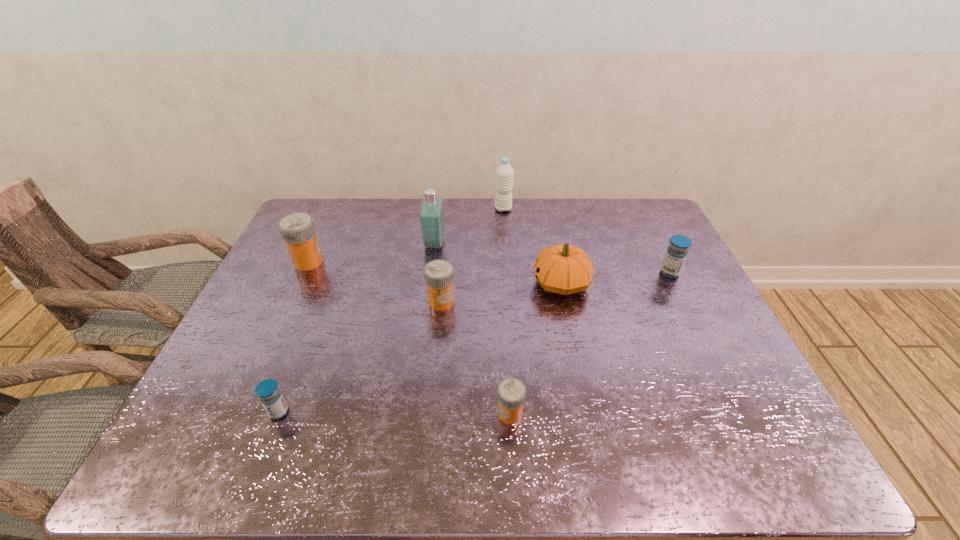
Locate an element on the screen. The width and height of the screenshot is (960, 540). vacant space located on the side of the second object from right to left with the carved face is located at coordinates (443, 283).

I want to click on free space located 0.330m on the front of the rightmost object, so click(718, 370).

Where is `blank space located on the label side of the third nearest medicine`? The width and height of the screenshot is (960, 540). blank space located on the label side of the third nearest medicine is located at coordinates (434, 381).

The image size is (960, 540). I want to click on free region located on the left of the second medicine from left to right, so click(201, 412).

Locate an element on the screen. vacant space situated on the label side of the nearest orange medicine is located at coordinates (424, 414).

You are a GUI agent. You are given a task and a screenshot of the screen. Output one action in this format:
    pyautogui.click(x=<x>, y=<y>)
    Task: Click on the vacant region located on the label side of the nearest orange medicine
    The height and width of the screenshot is (540, 960).
    Given the screenshot: What is the action you would take?
    pyautogui.click(x=416, y=414)

Where is `vacant space located 0.150m on the label side of the nearest orange medicine`? The width and height of the screenshot is (960, 540). vacant space located 0.150m on the label side of the nearest orange medicine is located at coordinates (429, 414).

Identify the location of water bottle at the far edge. The width and height of the screenshot is (960, 540). (504, 177).

At what (x,y) coordinates should I click in order to perform the action: click on perfume that is at the far edge. Please return your answer as a coordinate pair (x, y). Looking at the image, I should click on (432, 222).

This screenshot has width=960, height=540. Identify the location of object at the left edge. (297, 230).